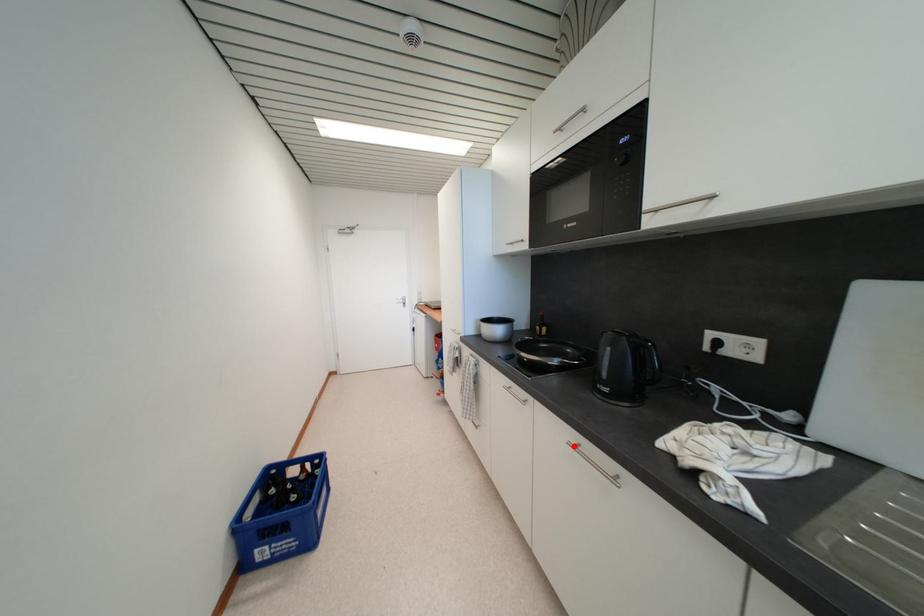
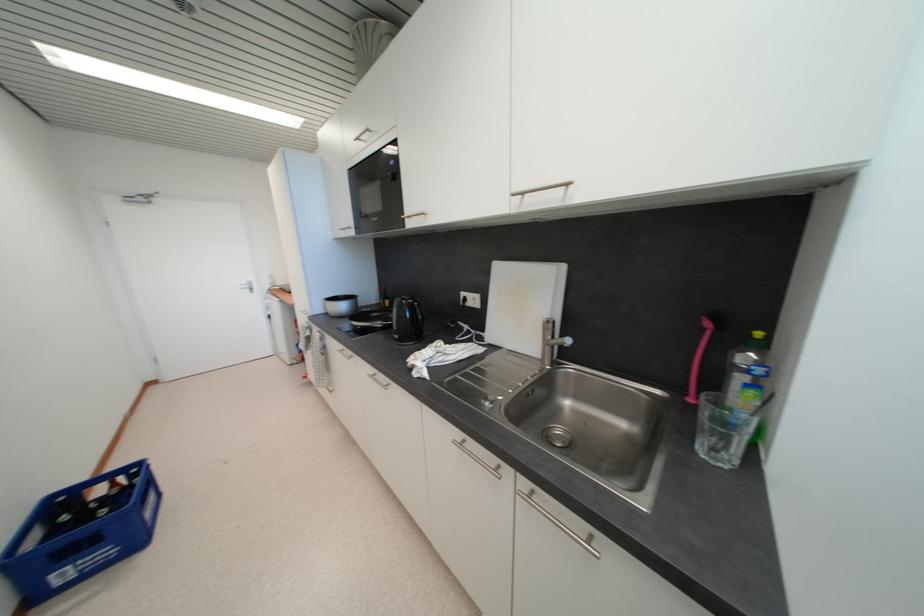
Where in the second image is the point corresponding to the highlighted location from the first image?

(373, 378)